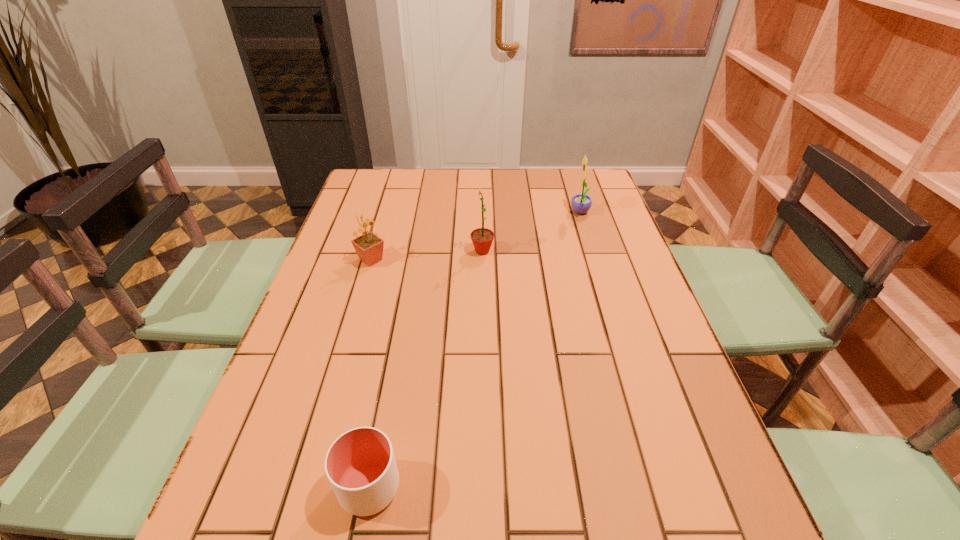
Locate an element on the screen. The width and height of the screenshot is (960, 540). vacant space at the far left corner of the desktop is located at coordinates (360, 183).

The height and width of the screenshot is (540, 960). In order to click on vacant space at the far right corner of the desktop in this screenshot , I will do `click(603, 185)`.

At what (x,y) coordinates should I click in order to perform the action: click on vacant area between the second sunflower from right to left and the rightmost sunflower. Please return your answer as a coordinate pair (x, y). The height and width of the screenshot is (540, 960). Looking at the image, I should click on (531, 232).

I want to click on vacant area between the shortest sunflower and the second object from right to left, so coord(426,255).

Image resolution: width=960 pixels, height=540 pixels. What are the coordinates of `free space between the shortest sunflower and the third object from left to right` in the screenshot? It's located at (426, 255).

You are a GUI agent. You are given a task and a screenshot of the screen. Output one action in this format:
    pyautogui.click(x=<x>, y=<y>)
    Task: Click on the free point between the third object from left to right and the rightmost object
    
    Given the screenshot: What is the action you would take?
    pyautogui.click(x=531, y=232)

Where is `unoccupied position between the third object from left to right and the rightmost sunflower`? Image resolution: width=960 pixels, height=540 pixels. unoccupied position between the third object from left to right and the rightmost sunflower is located at coordinates (531, 232).

The width and height of the screenshot is (960, 540). I want to click on vacant area between the second sunflower from right to left and the shortest sunflower, so click(426, 255).

Identify the location of vacant space that's between the second object from right to left and the shortest object. Image resolution: width=960 pixels, height=540 pixels. (426, 369).

Image resolution: width=960 pixels, height=540 pixels. What are the coordinates of `free space between the shortest object and the second sunflower from left to right` in the screenshot? It's located at 426,369.